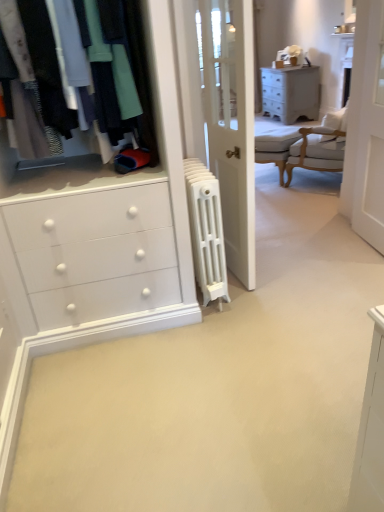
At what (x,y) coordinates should I click in order to perform the action: click on vacant area that is situated to the right of white cast iron radiator at center. Please return your answer as a coordinate pair (x, y). Looking at the image, I should click on (274, 284).